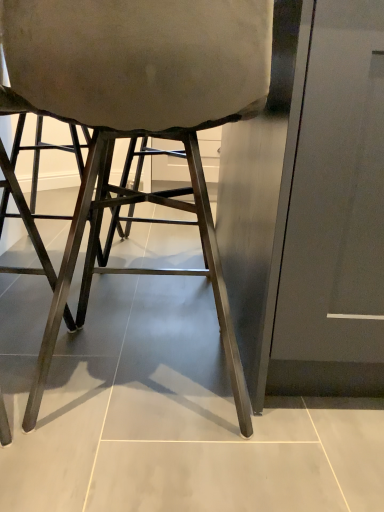
What do you see at coordinates (134, 123) in the screenshot? I see `metallic gray chair at center` at bounding box center [134, 123].

The image size is (384, 512). What are the coordinates of `metallic gray chair at center` in the screenshot? It's located at pyautogui.click(x=134, y=123).

Find the location of a particular element. Image resolution: width=384 pixels, height=512 pixels. metallic gray chair at center is located at coordinates (134, 123).